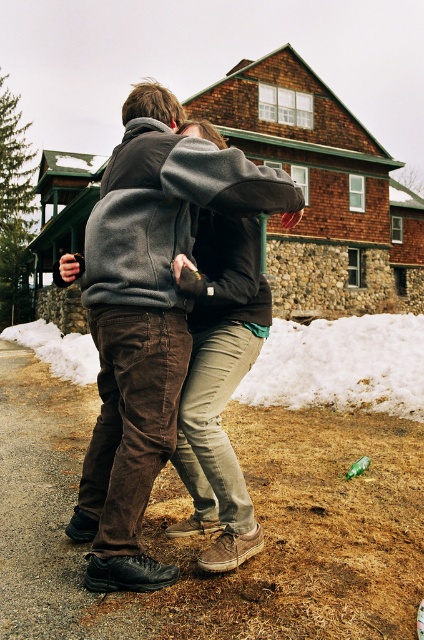
Who is lower down, brown corduroy pants at center or white powdery snow at lower center?

Positioned lower is white powdery snow at lower center.

Who is higher up, brown corduroy pants at center or white powdery snow at lower center?

brown corduroy pants at center

Is point (111, 492) more distant than point (345, 337)?

No, it is not.

The image size is (424, 640). I want to click on brown corduroy pants at center, so click(x=147, y=316).